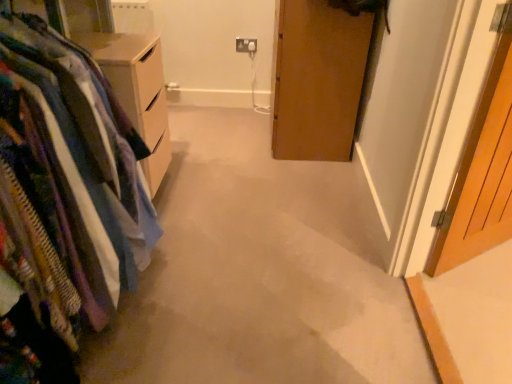
Question: Would you say wooden door at right is to the left or to the right of textured fabric closet at left in the picture?

Choices:
 (A) left
 (B) right

Answer: (B)

Question: Is point [x=484, y=238] closer or farther from the camera than point [x=32, y=51]?

Choices:
 (A) closer
 (B) farther

Answer: (B)

Question: Which object is the closest to the textured fabric closet at left?

Choices:
 (A) white plastic electric outlet at upper center
 (B) wooden door at right

Answer: (B)

Question: Estimate the real-world distances between objects in this image. Which object is farther from the wooden door at right?

Choices:
 (A) textured fabric closet at left
 (B) white plastic electric outlet at upper center

Answer: (B)